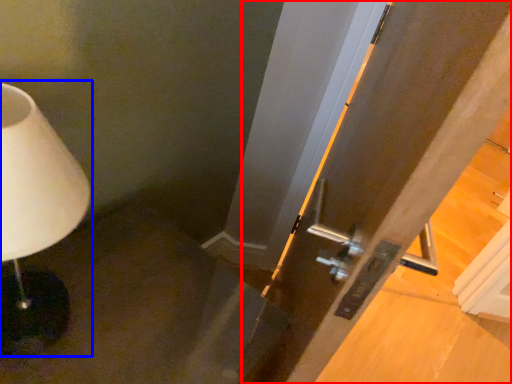
Question: Which point is closer to the camera, door (highlighted by a red box) or lamp (highlighted by a blue box)?

Choices:
 (A) door
 (B) lamp

Answer: (A)